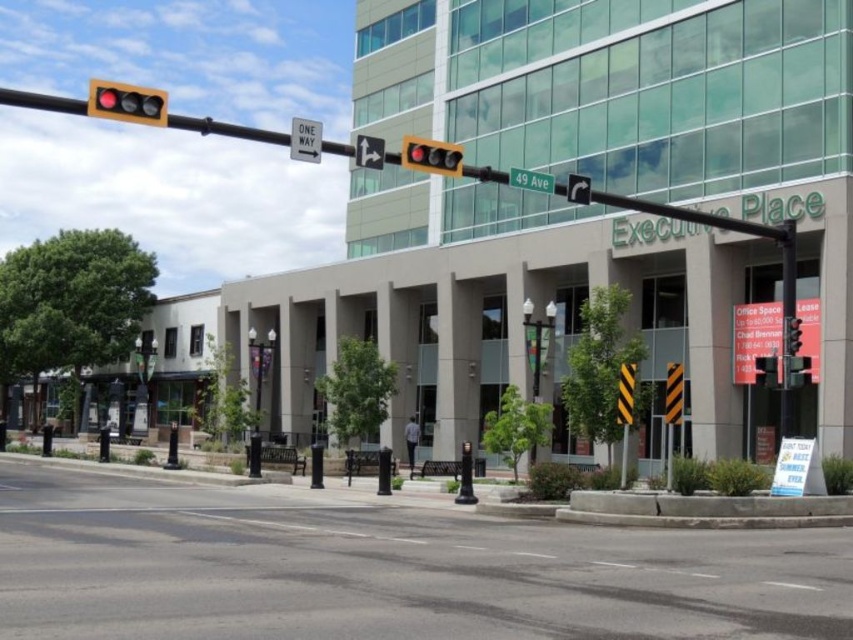
You are a delivery driver approaching the intersection and need to turn left. You see the black asphalt road at center and the green matte street sign at upper center. Which object is closer to you as you approach the intersection?

The black asphalt road at center is closer to the viewer than the green matte street sign at upper center, so the black asphalt road at center is closer to you as you approach the intersection.

You are a delivery driver approaching the intersection and need to know if the black asphalt road at center is closer to you than the matte black traffic light at upper left. Can you determine this based on the scene?

Yes, according to the scene description, the black asphalt road at center is closer to the viewer than the matte black traffic light at upper left.